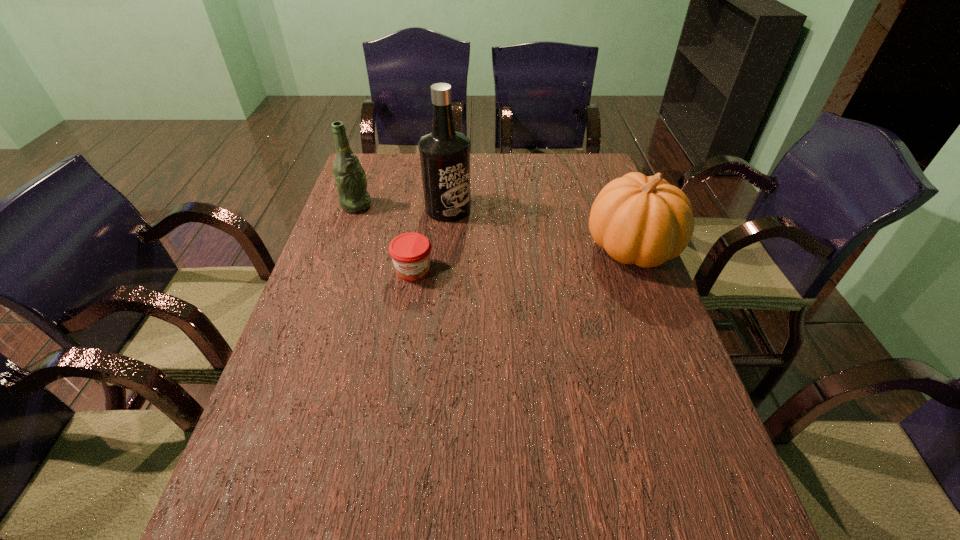
Locate an element on the screen. The image size is (960, 540). unoccupied area between the leftmost object and the rightmost object is located at coordinates (494, 227).

Identify the location of free space between the pumpkin and the leftmost object. (494, 227).

Locate an element on the screen. Image resolution: width=960 pixels, height=540 pixels. vacant region between the shortest object and the rightmost object is located at coordinates (522, 259).

Where is `vacant area between the rightmost object and the beer bottle`? This screenshot has width=960, height=540. vacant area between the rightmost object and the beer bottle is located at coordinates (494, 227).

Image resolution: width=960 pixels, height=540 pixels. What are the coordinates of `empty space between the beer bottle and the tallest object` in the screenshot? It's located at (402, 207).

Locate an element on the screen. The image size is (960, 540). empty space between the jam and the tallest object is located at coordinates pos(431,239).

Locate which object is the third closest to the pumpkin. Please provide its 2D coordinates. Your answer should be formatted as a tuple, i.e. [(x, y)], where the tuple contains the x and y coordinates of a point satisfying the conditions above.

[(350, 177)]

Identify the location of object that stands as the closest to the rightmost object. This screenshot has height=540, width=960. point(444,153).

Where is `vacant region that satisfies the following two spatial constraints: 1. on the front side of the tallest object; 2. on the left side of the pumpkin`? vacant region that satisfies the following two spatial constraints: 1. on the front side of the tallest object; 2. on the left side of the pumpkin is located at coordinates (444, 248).